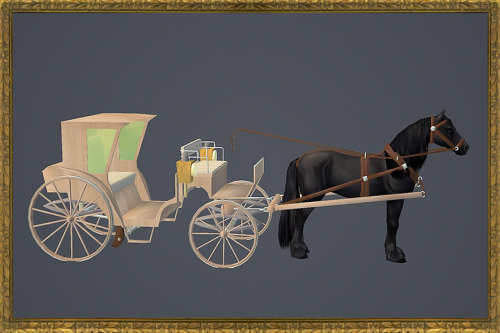
Where is `golden frame`? golden frame is located at coordinates (146, 5).